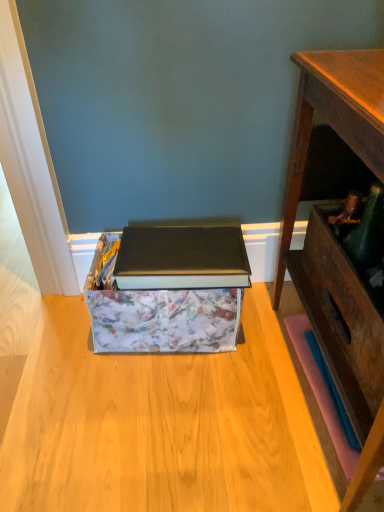
Where is `vacant area located to the right-hand side of floral-patterned cardboard box at center`? The width and height of the screenshot is (384, 512). vacant area located to the right-hand side of floral-patterned cardboard box at center is located at coordinates (267, 338).